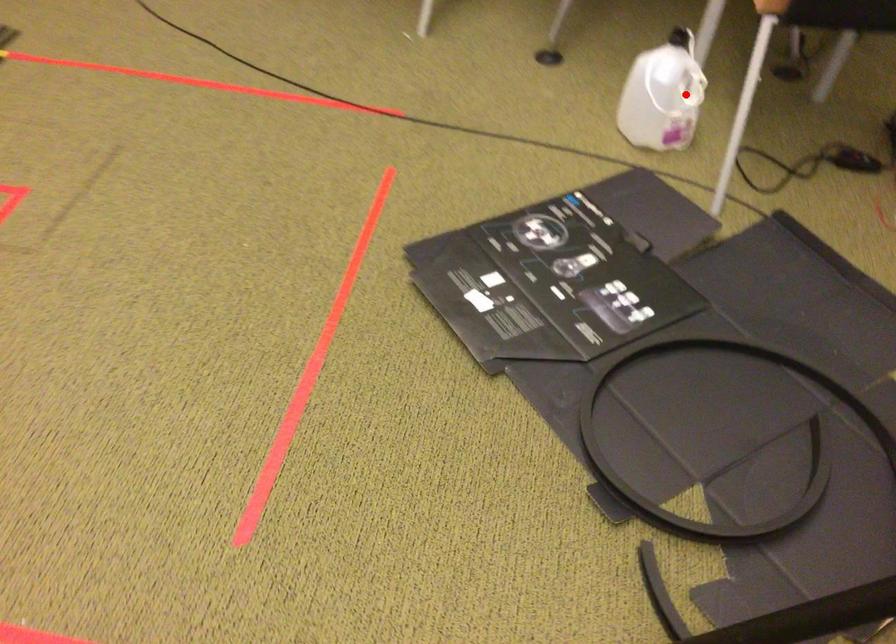
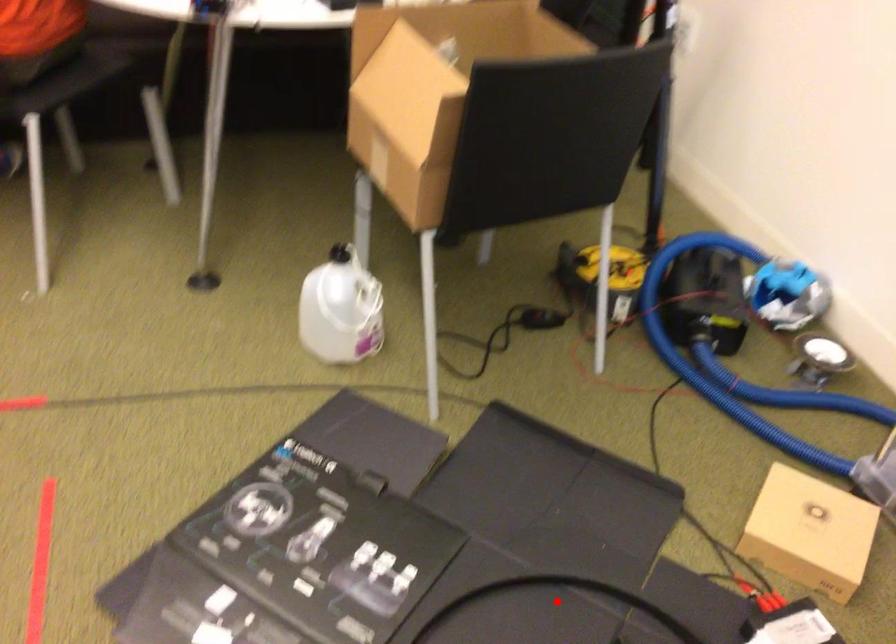
I am providing you with two images of the same scene from different viewpoints. A red point is marked on the first image and another point is marked on the second image. Does the point marked in image1 correspond to the same location as the one in image2?

No